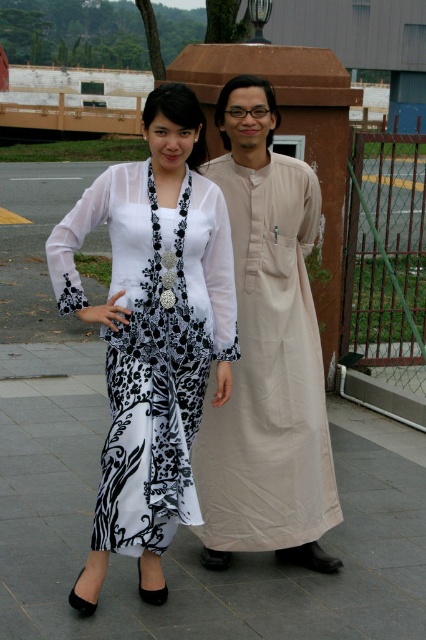
Question: In this image, where is white sheer blouse at upper left located relative to white sheer dress at center?

Choices:
 (A) above
 (B) below

Answer: (A)

Question: Which point appears farthest from the camera in this image?

Choices:
 (A) (103, 592)
 (B) (121, 536)

Answer: (A)

Question: Is black fabric skirt at lower center wider than white sheer dress at center?

Choices:
 (A) yes
 (B) no

Answer: (A)

Question: Considering the real-world distances, which object is farthest from the beige cotton robe at center?

Choices:
 (A) white sheer blouse at upper left
 (B) white sheer dress at center
 (C) black fabric skirt at lower center

Answer: (C)

Question: Does white sheer blouse at upper left have a smaller size compared to beige cotton robe at center?

Choices:
 (A) yes
 (B) no

Answer: (B)

Question: Which object is positioned farthest from the beige cotton robe at center?

Choices:
 (A) white sheer blouse at upper left
 (B) black fabric skirt at lower center

Answer: (B)